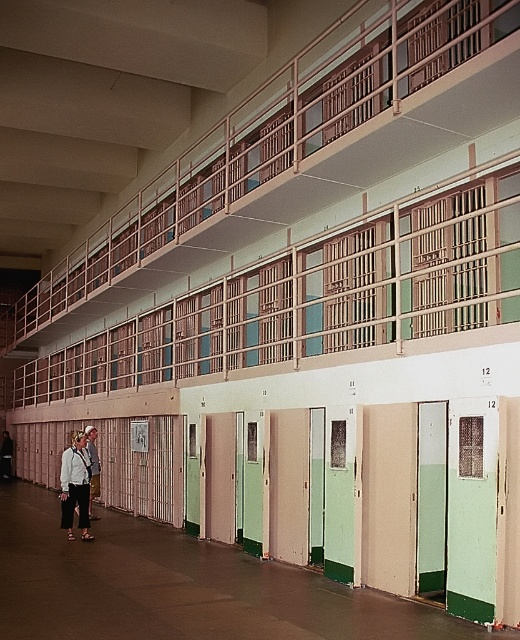
Question: Which point is closer to the camera?

Choices:
 (A) (99, 465)
 (B) (67, 458)

Answer: (B)

Question: Can you confirm if white cotton shirt at lower left is positioned to the right of light brown leather jacket at lower left?

Choices:
 (A) no
 (B) yes

Answer: (B)

Question: Can you confirm if white cotton shirt at lower left is wider than light brown leather jacket at lower left?

Choices:
 (A) yes
 (B) no

Answer: (A)

Question: Is white cotton shirt at lower left in front of light brown leather jacket at lower left?

Choices:
 (A) yes
 (B) no

Answer: (A)

Question: Which point is closer to the camera?

Choices:
 (A) light brown leather jacket at lower left
 (B) white cotton shirt at lower left

Answer: (B)

Question: Among these objects, which one is farthest from the camera?

Choices:
 (A) white cotton shirt at lower left
 (B) light brown leather jacket at lower left

Answer: (B)